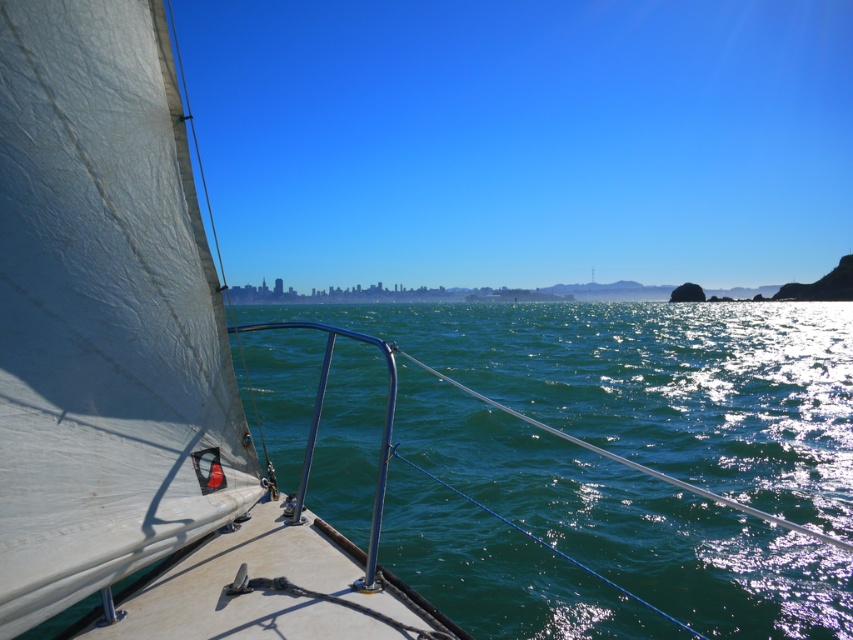
Question: Estimate the real-world distances between objects in this image. Which object is closer to the green water at center?

Choices:
 (A) white sail at left
 (B) white matte sail at center

Answer: (B)

Question: Which is nearer to the white matte sail at center?

Choices:
 (A) green water at center
 (B) white sail at left

Answer: (A)

Question: Which point is closer to the camera taking this photo?

Choices:
 (A) (183, 148)
 (B) (625, 508)

Answer: (A)

Question: Can you confirm if white sail at left is positioned below green water at center?

Choices:
 (A) yes
 (B) no

Answer: (B)

Question: Does green water at center lie behind white matte sail at center?

Choices:
 (A) no
 (B) yes

Answer: (B)

Question: From the image, what is the correct spatial relationship of green water at center in relation to white matte sail at center?

Choices:
 (A) below
 (B) above

Answer: (B)